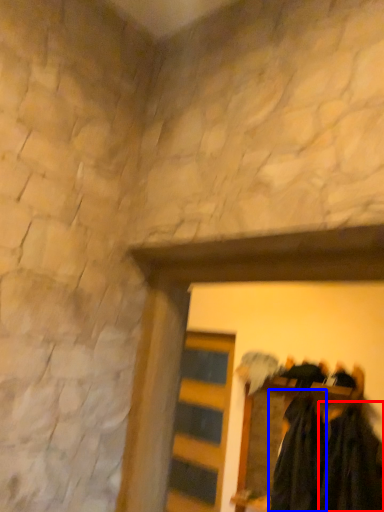
Question: Among these objects, which one is nearest to the camera, clothing (highlighted by a red box) or clothing (highlighted by a blue box)?

Choices:
 (A) clothing
 (B) clothing

Answer: (A)